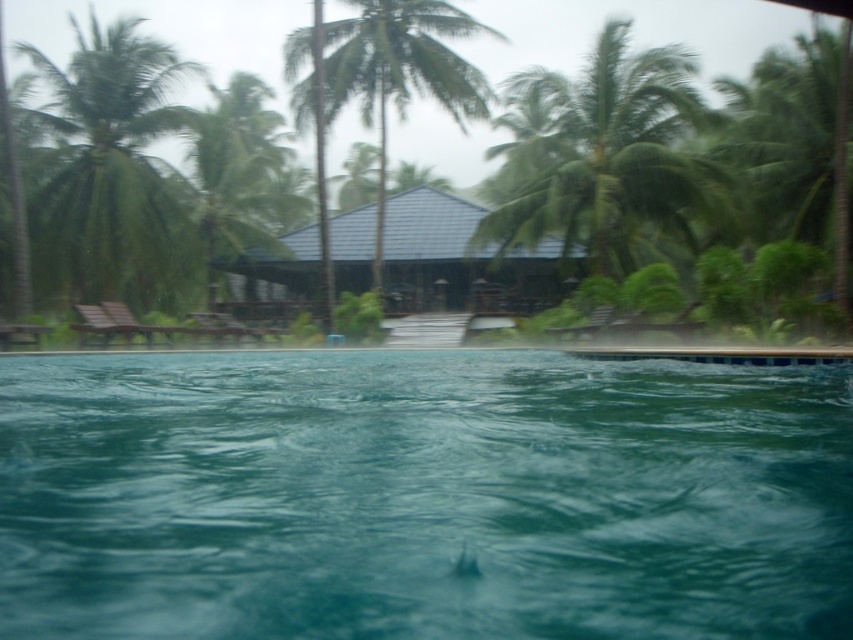
Can you confirm if green glossy pool at center is taller than green leafy palm tree at upper left?

In fact, green glossy pool at center may be shorter than green leafy palm tree at upper left.

At what (x,y) coordinates should I click in order to perform the action: click on green glossy pool at center. Please return your answer as a coordinate pair (x, y). This screenshot has height=640, width=853. Looking at the image, I should click on (422, 497).

From the picture: Which is more to the right, green leafy palm tree at upper center or green leafy palm tree at upper right?

green leafy palm tree at upper right

Is green leafy palm tree at upper center wider than green leafy palm tree at upper right?

Incorrect, green leafy palm tree at upper center's width does not surpass green leafy palm tree at upper right's.

Between point (529, 168) and point (840, 220), which one is positioned in front?

Point (840, 220)

The height and width of the screenshot is (640, 853). In order to click on green leafy palm tree at upper center in this screenshot , I will do `click(601, 150)`.

Can you confirm if green glossy pool at center is positioned to the right of green leafy palm tree at upper right?

Incorrect, green glossy pool at center is not on the right side of green leafy palm tree at upper right.

Who is more distant from viewer, [815,468] or [845,154]?

The point [845,154] is more distant.

Find the location of `green glossy pool at center`. green glossy pool at center is located at coordinates tap(422, 497).